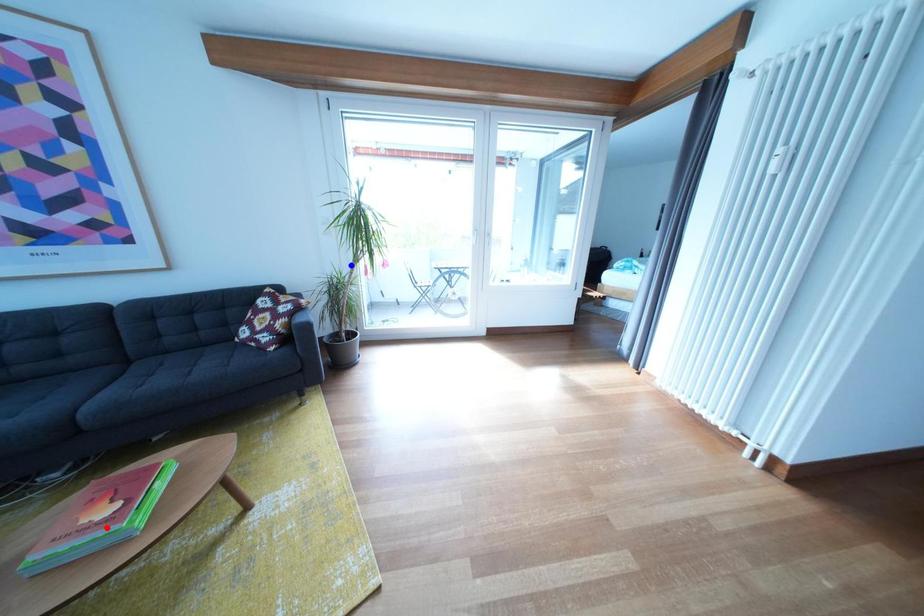
Question: Which of the two points in the image is closer to the camera?

Choices:
 (A) Blue point is closer.
 (B) Red point is closer.

Answer: (B)